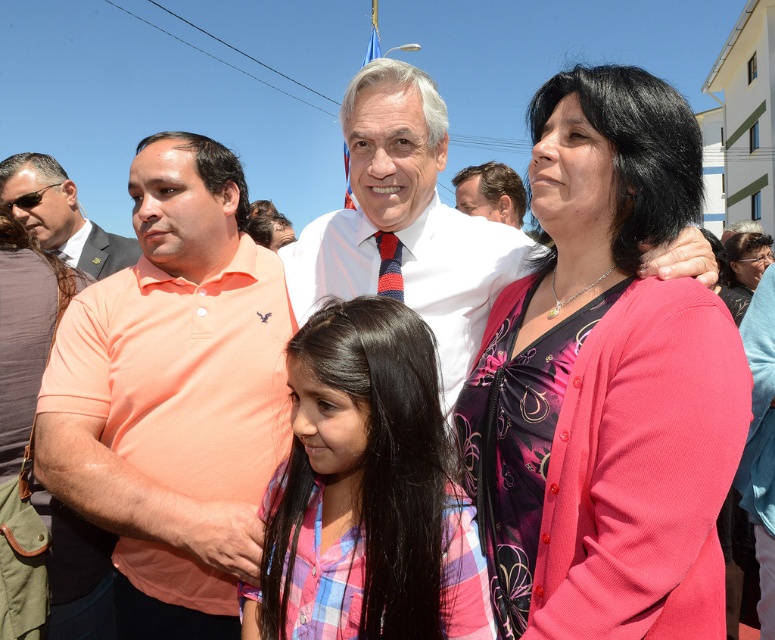
Question: Which object appears farthest from the camera in this image?

Choices:
 (A) matte peach polo shirt at left
 (B) white shirt at center
 (C) matte black suit at left

Answer: (C)

Question: Does matte black suit at left appear under red and blue striped tie at center?

Choices:
 (A) yes
 (B) no

Answer: (B)

Question: Among these objects, which one is farthest from the camera?

Choices:
 (A) matte peach polo shirt at left
 (B) plaid fabric shirt at center
 (C) white shirt at center
 (D) smooth white shirt at center

Answer: (D)

Question: Which point is closer to the camera?

Choices:
 (A) matte peach polo shirt at left
 (B) matte black suit at left

Answer: (A)

Question: Is matte peach polo shirt at left to the left of white shirt at center from the viewer's perspective?

Choices:
 (A) no
 (B) yes

Answer: (B)

Question: Can you confirm if pink matte cardigan at center is positioned above plaid fabric shirt at center?

Choices:
 (A) no
 (B) yes

Answer: (B)